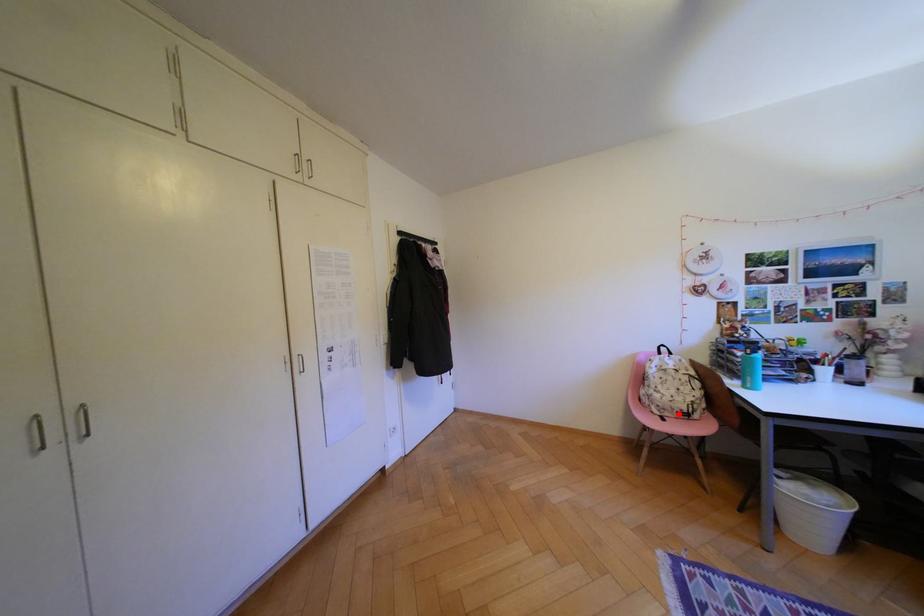
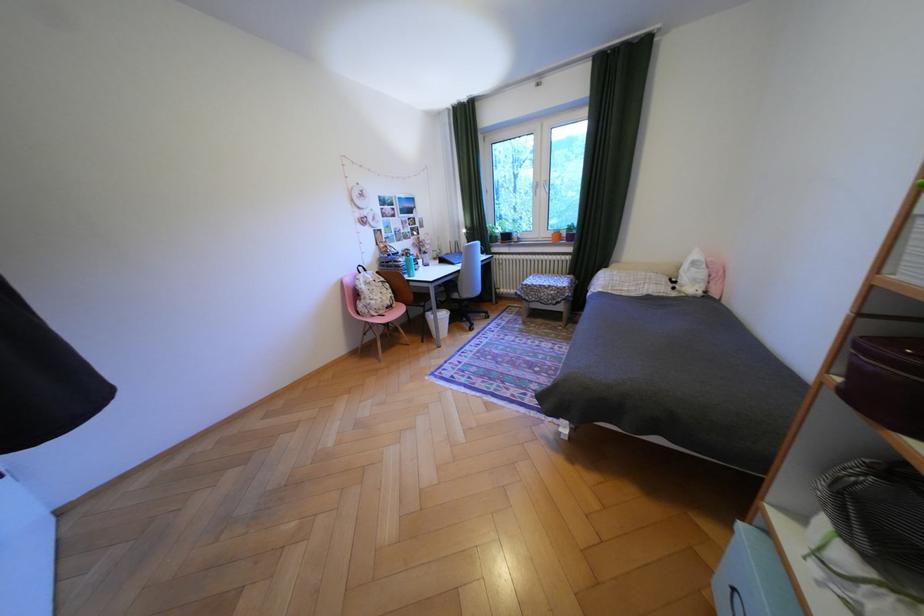
Question: I am providing you with two images of the same scene from different viewpoints. A red point is marked on the first image. At the location where the point appears in image 1, is it still visible in image 2?

Choices:
 (A) Yes
 (B) No

Answer: (A)